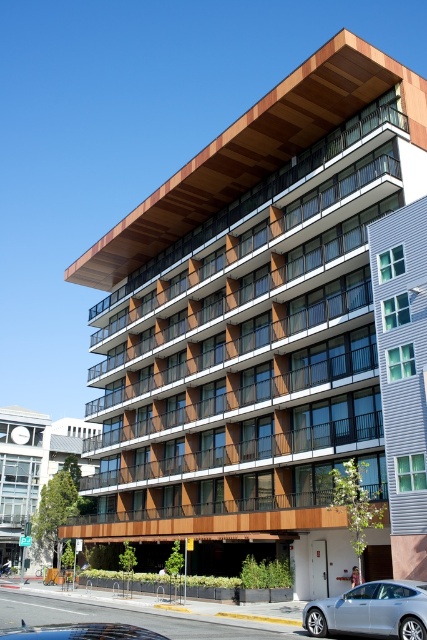
Does green glass windows at upper right have a lesser height compared to matte gray building at center?

Yes, green glass windows at upper right is shorter than matte gray building at center.

Is green glass windows at upper right to the left of matte gray building at center from the viewer's perspective?

No, green glass windows at upper right is not to the left of matte gray building at center.

Which is in front, point (415, 230) or point (3, 506)?

Point (415, 230) is more forward.

At what (x,y) coordinates should I click in order to perform the action: click on green glass windows at upper right. Please return your answer as a coordinate pair (x, y). The width and height of the screenshot is (427, 640). Looking at the image, I should click on (403, 376).

Between matte gray building at center and silver metallic car at lower right, which one has less height?

silver metallic car at lower right is shorter.

Describe the element at coordinates (32, 465) in the screenshot. The image size is (427, 640). I see `matte gray building at center` at that location.

Find the location of a particular element. The image size is (427, 640). matte gray building at center is located at coordinates (32, 465).

Does point (417, 205) come in front of point (342, 616)?

No.

Who is higher up, green glass windows at upper right or silver metallic car at lower right?

Positioned higher is green glass windows at upper right.

What do you see at coordinates (403, 376) in the screenshot?
I see `green glass windows at upper right` at bounding box center [403, 376].

This screenshot has height=640, width=427. I want to click on green glass windows at upper right, so click(x=403, y=376).